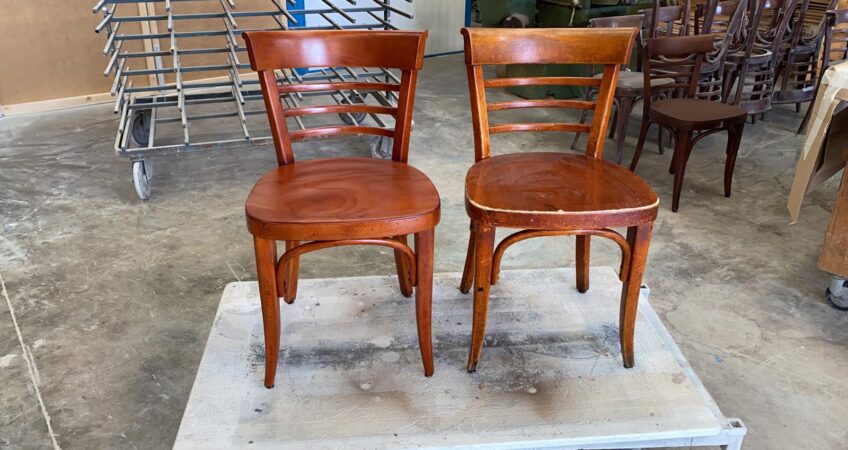
Identify the location of chair backs. This screenshot has width=848, height=450. (338, 47), (542, 49), (685, 46), (628, 19), (666, 10), (801, 94), (756, 104).